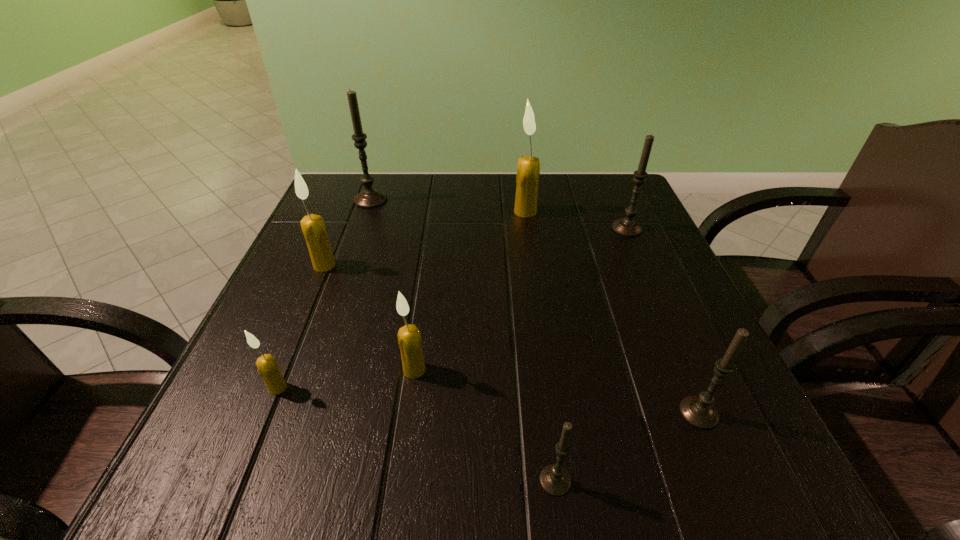
In the image, there is a desktop. Where is `free region at the right edge`? free region at the right edge is located at coordinates coord(652,273).

The image size is (960, 540). Find the location of `blank space at the far left corner`. blank space at the far left corner is located at coordinates (340, 190).

Where is `vacant region at the far right corner of the desktop`? The height and width of the screenshot is (540, 960). vacant region at the far right corner of the desktop is located at coordinates (616, 197).

Identify the location of vacant region at the near right corner of the desktop. The height and width of the screenshot is (540, 960). point(778,491).

Identify the location of unoccupied position between the fifth candle from right to left and the third nearest object. This screenshot has height=540, width=960. (347, 379).

Identify the location of free space between the nearest candle and the fifth nearest candle. The width and height of the screenshot is (960, 540). (440, 373).

Locate an element on the screen. The width and height of the screenshot is (960, 540). vacant space that is in between the third biggest gray candle and the smallest gray candle is located at coordinates (627, 447).

Image resolution: width=960 pixels, height=540 pixels. I want to click on unoccupied area between the second nearest gray candle and the third smallest gray candle, so click(662, 320).

You are a GUI agent. You are given a task and a screenshot of the screen. Output one action in this format:
    pyautogui.click(x=<x>, y=<y>)
    Task: Click on the free point between the nearest cream candle and the sixth nearest candle
    The width and height of the screenshot is (960, 540).
    Given the screenshot: What is the action you would take?
    pyautogui.click(x=452, y=308)

The width and height of the screenshot is (960, 540). Find the location of `unoccupied area between the farthest gray candle and the second farthest cream candle`. unoccupied area between the farthest gray candle and the second farthest cream candle is located at coordinates click(x=348, y=232).